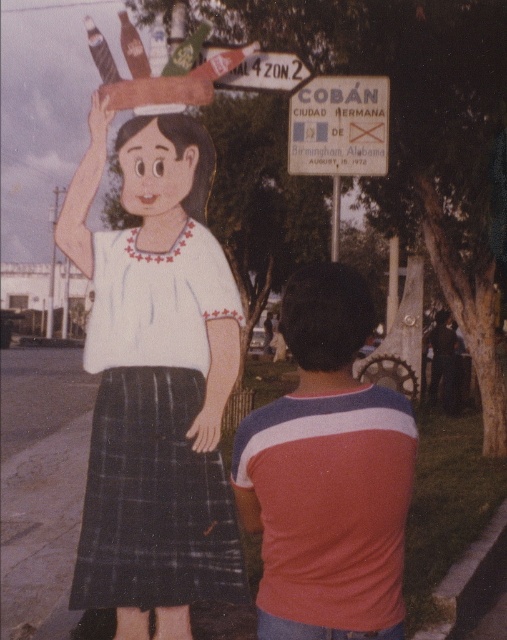
Can you confirm if matte white blouse at center is positioned to the right of striped cotton shirt at center?

In fact, matte white blouse at center is to the left of striped cotton shirt at center.

Is matte white blouse at center thinner than striped cotton shirt at center?

No, matte white blouse at center is not thinner than striped cotton shirt at center.

Find the location of `matte white blouse at center`. matte white blouse at center is located at coordinates (155, 381).

Is matte white blouse at center to the right of metallic silver sign at upper center from the viewer's perspective?

Incorrect, matte white blouse at center is not on the right side of metallic silver sign at upper center.

Looking at this image, is matte white blouse at center shorter than metallic silver sign at upper center?

Incorrect, matte white blouse at center's height does not fall short of metallic silver sign at upper center's.

This screenshot has height=640, width=507. Describe the element at coordinates (155, 381) in the screenshot. I see `matte white blouse at center` at that location.

The width and height of the screenshot is (507, 640). I want to click on matte white blouse at center, so click(x=155, y=381).

Between point (160, 401) and point (340, 156), which one is positioned behind?

Positioned behind is point (340, 156).

Is plaid wool skirt at center further to the viewer compared to metallic silver sign at upper center?

No, it is in front of metallic silver sign at upper center.

Who is more forward, (130, 589) or (382, 145)?

Point (130, 589) is more forward.

Locate an element on the screen. Image resolution: width=507 pixels, height=640 pixels. plaid wool skirt at center is located at coordinates (154, 499).